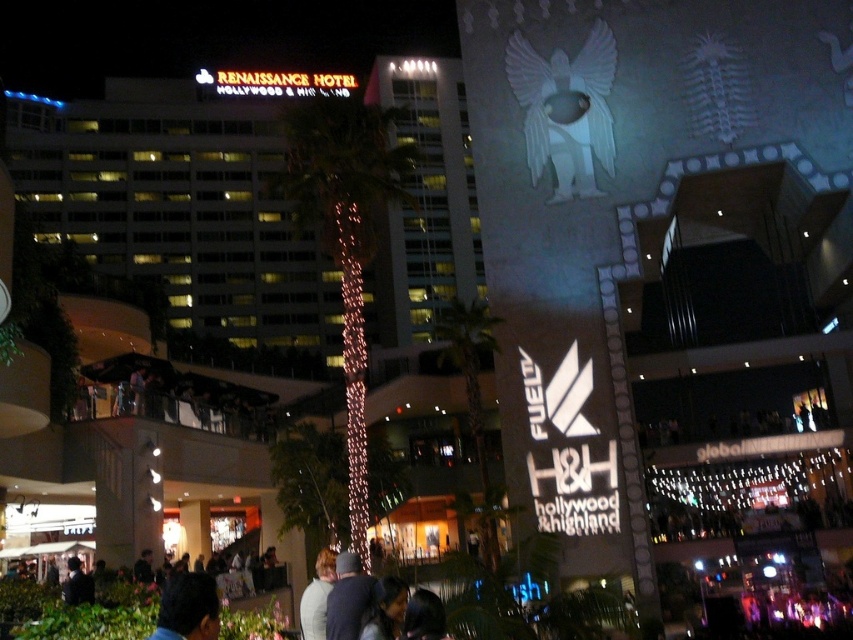
You are standing in the crowd at Hollywood and Highland Center and want to take a photo of both the point at coordinates point (368, 278) and point (369, 593). Which point should you move closer to in order to include both in your photo without zooming?

You should move closer to point (369, 593) because point (368, 278) is further away from you than point (369, 593). By moving towards the closer point, you can better frame both points in your photo without needing to zoom.

You are standing at the lower center of the Hollywood and Highland Center and see the dark gray knit cap at lower center and the matte glass hotel at upper left. Which object is higher in the scene?

The matte glass hotel at upper left is positioned over dark gray knit cap at lower center, so it is higher in the scene.

You are a tourist standing at the Hollywood Walk of Fame and see the matte glass hotel at upper left and the dark gray knit cap at lower center. Which object is located more to the left side?

The matte glass hotel at upper left is located more to the left side than the dark gray knit cap at lower center.